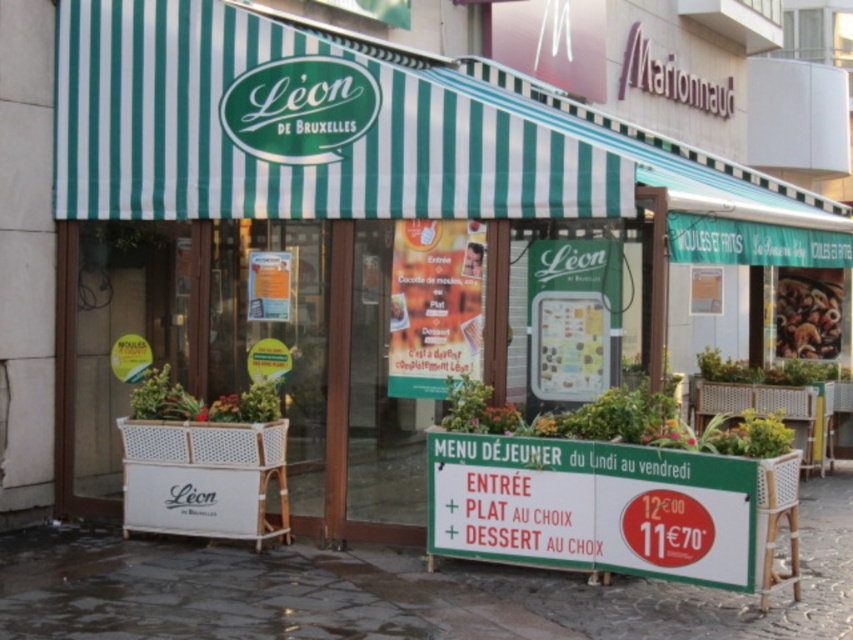
Measure the distance between dark gray stone pavement at lower center and green plastic sign at center.

1.66 meters

Who is lower down, dark gray stone pavement at lower center or green plastic sign at center?

dark gray stone pavement at lower center

Is point (560, 609) farther from camera compared to point (450, 525)?

No, (560, 609) is in front of (450, 525).

At what (x,y) coordinates should I click in order to perform the action: click on dark gray stone pavement at lower center. Please return your answer as a coordinate pair (x, y). This screenshot has width=853, height=640. Looking at the image, I should click on (396, 592).

Who is more forward, (450, 113) or (480, 440)?

Point (480, 440) is more forward.

Does green striped awning at upper center have a lesser width compared to green plastic sign at center?

No, green striped awning at upper center is not thinner than green plastic sign at center.

Image resolution: width=853 pixels, height=640 pixels. Find the location of `green striped awning at upper center`. green striped awning at upper center is located at coordinates (293, 128).

Based on the photo, which of these two, green striped awning at upper center or dark gray stone pavement at lower center, stands shorter?

dark gray stone pavement at lower center

Does green striped awning at upper center have a lesser width compared to dark gray stone pavement at lower center?

No.

The width and height of the screenshot is (853, 640). What do you see at coordinates (293, 128) in the screenshot?
I see `green striped awning at upper center` at bounding box center [293, 128].

Find the location of a particular element. The width and height of the screenshot is (853, 640). green striped awning at upper center is located at coordinates (293, 128).